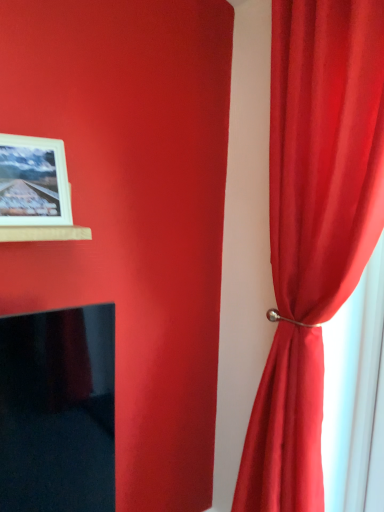
In the scene shown: Measure the distance between satin red curtain at right and camera.

They are 38.63 inches apart.

This screenshot has height=512, width=384. I want to click on satin red curtain at right, so click(x=314, y=229).

This screenshot has width=384, height=512. What do you see at coordinates (314, 229) in the screenshot?
I see `satin red curtain at right` at bounding box center [314, 229].

What is the approximate height of white matte picture frame at upper left?

It is 11.68 inches.

The image size is (384, 512). Describe the element at coordinates (33, 182) in the screenshot. I see `white matte picture frame at upper left` at that location.

Locate an element on the screen. The width and height of the screenshot is (384, 512). white matte picture frame at upper left is located at coordinates (33, 182).

Locate an element on the screen. satin red curtain at right is located at coordinates (314, 229).

Looking at this image, considering the relative positions of satin red curtain at right and white matte picture frame at upper left in the image provided, is satin red curtain at right to the left of white matte picture frame at upper left from the viewer's perspective?

No, satin red curtain at right is not to the left of white matte picture frame at upper left.

In the image, is satin red curtain at right positioned in front of or behind white matte picture frame at upper left?

satin red curtain at right is positioned closer to the viewer than white matte picture frame at upper left.

Considering the points (328, 200) and (64, 180), which point is behind, point (328, 200) or point (64, 180)?

The point (64, 180) is behind.

From the image's perspective, who appears lower, satin red curtain at right or white matte picture frame at upper left?

satin red curtain at right appears lower in the image.

From a real-world perspective, is satin red curtain at right below white matte picture frame at upper left?

Yes.

Considering the relative sizes of satin red curtain at right and white matte picture frame at upper left in the image provided, is satin red curtain at right thinner than white matte picture frame at upper left?

No, satin red curtain at right is not thinner than white matte picture frame at upper left.

Who is shorter, satin red curtain at right or white matte picture frame at upper left?

With less height is white matte picture frame at upper left.

Which of these two, satin red curtain at right or white matte picture frame at upper left, is smaller?

white matte picture frame at upper left is smaller.

Is satin red curtain at right not inside white matte picture frame at upper left?

Yes, satin red curtain at right is outside of white matte picture frame at upper left.

Is satin red curtain at right touching white matte picture frame at upper left?

No, satin red curtain at right is not in contact with white matte picture frame at upper left.

Is satin red curtain at right turned away from white matte picture frame at upper left?

satin red curtain at right is not turned away from white matte picture frame at upper left.

How different are the orientations of satin red curtain at right and white matte picture frame at upper left in degrees?

The facing directions of satin red curtain at right and white matte picture frame at upper left are 88 degrees apart.

In the image, there is a white matte picture frame at upper left. Where is `curtain below it (from a real-world perspective)`? The image size is (384, 512). curtain below it (from a real-world perspective) is located at coordinates (314, 229).

Can you confirm if white matte picture frame at upper left is positioned to the right of satin red curtain at right?

No, white matte picture frame at upper left is not to the right of satin red curtain at right.

Which object is closer to the camera, white matte picture frame at upper left or satin red curtain at right?

satin red curtain at right is more forward.

Is point (21, 197) closer to camera compared to point (265, 384)?

Yes.

From the image's perspective, is white matte picture frame at upper left on satin red curtain at right?

Yes, from the image's perspective, white matte picture frame at upper left is over satin red curtain at right.

From a real-world perspective, who is located lower, white matte picture frame at upper left or satin red curtain at right?

satin red curtain at right is physically lower.

Can you confirm if white matte picture frame at upper left is wider than satin red curtain at right?

Incorrect, the width of white matte picture frame at upper left does not surpass that of satin red curtain at right.

Who is taller, white matte picture frame at upper left or satin red curtain at right?

satin red curtain at right.

Can you confirm if white matte picture frame at upper left is smaller than satin red curtain at right?

Correct, white matte picture frame at upper left occupies less space than satin red curtain at right.

Can we say white matte picture frame at upper left lies outside satin red curtain at right?

white matte picture frame at upper left lies outside satin red curtain at right's area.

Are white matte picture frame at upper left and satin red curtain at right located far from each other?

No, white matte picture frame at upper left is not far from satin red curtain at right.

Is white matte picture frame at upper left turned away from satin red curtain at right?

That's not correct — white matte picture frame at upper left is not looking away from satin red curtain at right.

How many degrees apart are the facing directions of white matte picture frame at upper left and satin red curtain at right?

88 degrees.

In order to click on curtain to the right of white matte picture frame at upper left in this screenshot , I will do `click(314, 229)`.

Locate an element on the screen. The width and height of the screenshot is (384, 512). curtain below the white matte picture frame at upper left (from a real-world perspective) is located at coordinates (314, 229).

Find the location of `picture frame positioned vertically above the satin red curtain at right (from a real-world perspective)`. picture frame positioned vertically above the satin red curtain at right (from a real-world perspective) is located at coordinates point(33,182).